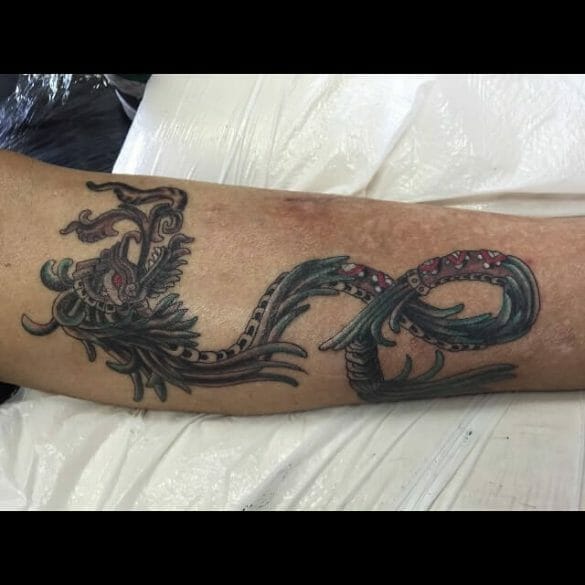
Where is `1 plastic covering`? 1 plastic covering is located at coordinates (363, 456).